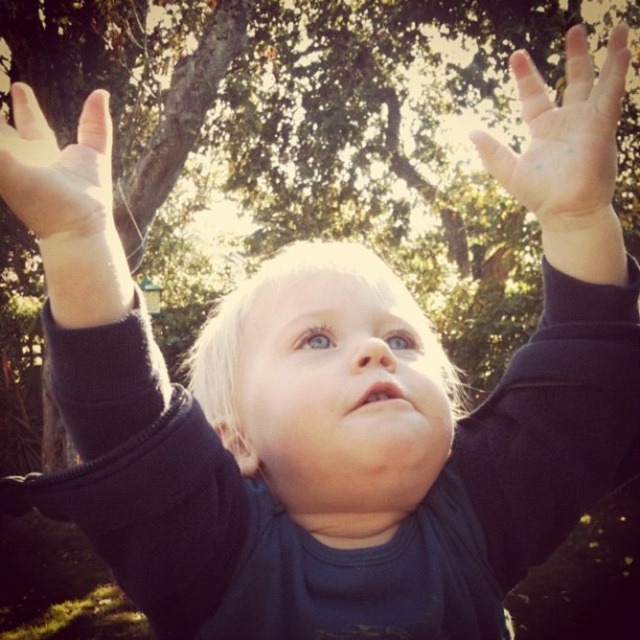
You are a photographer trying to capture the child in the image. You notice the smooth skin palm at upper center and the smooth skin hand at upper left. Which hand should you focus on to ensure the subject is in the foreground?

The smooth skin palm at upper center is in the foreground because the smooth skin hand at upper left is behind it.

In the scene shown: You are a photographer trying to capture the perfect shot of the child. You notice the dark blue fabric at upper center and the smooth skin hand at upper left in your viewfinder. Which object should you focus on if you want to highlight something smaller in the scene?

The dark blue fabric at upper center is smaller than the smooth skin hand at upper left, so you should focus on the dark blue fabric at upper center to highlight the smaller object.

You are a photographer adjusting the lighting for a photo shoot. You notice the matte black arm at upper left and the smooth skin palm at upper center in the frame. Which object should you adjust the lighting for to ensure proper exposure, considering their sizes?

The matte black arm at upper left should have its lighting adjusted because it is wider than the smooth skin palm at upper center, requiring more light to avoid underexposure.